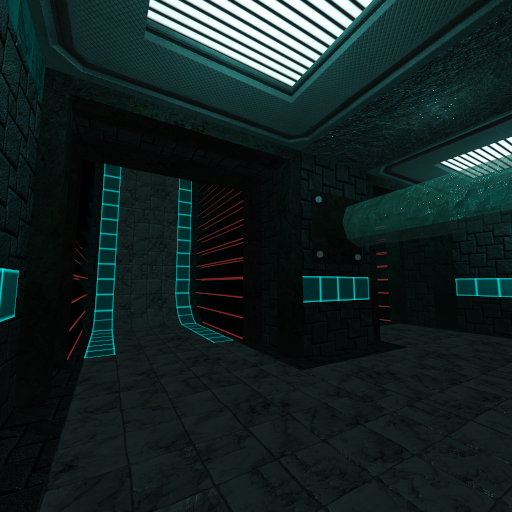
This screenshot has width=512, height=512. I want to click on tile, so click(x=229, y=385).